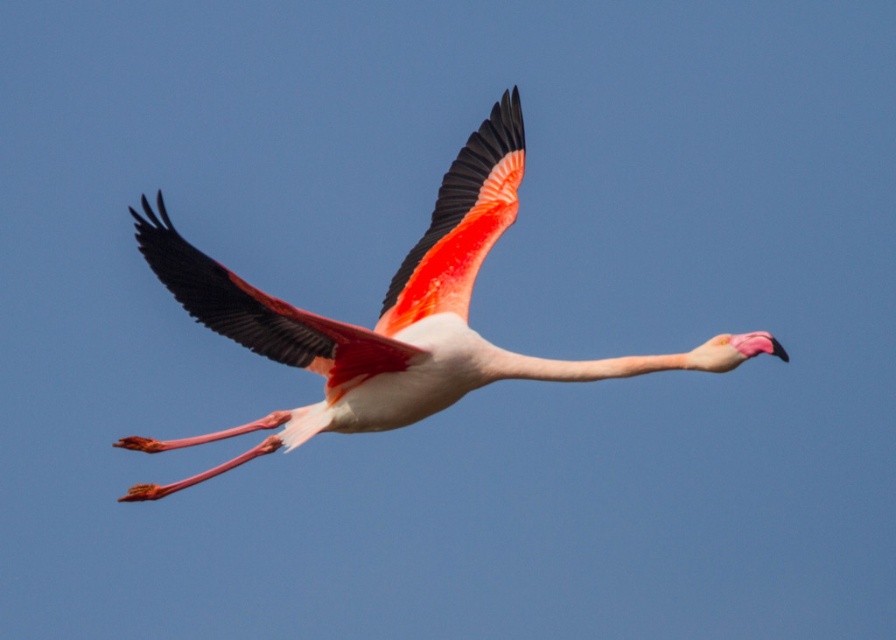
You are a wildlife photographer trying to capture the flamingo in flight. You notice two distinct wings in the image. Which wing is shorter, the matte pink wing at center or the vivid pink feathered wing at center?

The matte pink wing at center is shorter than the vivid pink feathered wing at center according to the description.

You are a photographer trying to capture the pink glossy flamingo at center. You notice a point at coordinates point (392, 317). Where is this point located?

The point (392, 317) is located on the pink glossy flamingo at center.

You are a wildlife photographer aiming to capture the flamingo in flight. Given that the pink glossy flamingo at center is taller than the vivid pink feathered wing at center, which object should you focus on to ensure the entire body is in frame?

The pink glossy flamingo at center is taller than the vivid pink feathered wing at center, so focusing on the pink glossy flamingo at center will ensure the entire body is captured in the frame.